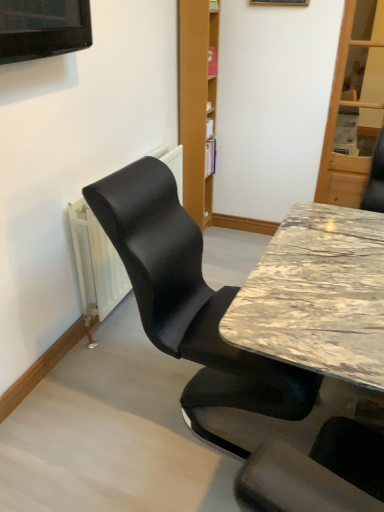
Question: From a real-world perspective, is marble table at center on black leather chair at left?

Choices:
 (A) yes
 (B) no

Answer: (B)

Question: Can you confirm if marble table at center is shorter than black leather chair at left?

Choices:
 (A) yes
 (B) no

Answer: (A)

Question: Would you say marble table at center is outside black leather chair at left?

Choices:
 (A) yes
 (B) no

Answer: (A)

Question: Is marble table at center at the right side of black leather chair at left?

Choices:
 (A) no
 (B) yes

Answer: (B)

Question: Can you confirm if marble table at center is thinner than black leather chair at left?

Choices:
 (A) yes
 (B) no

Answer: (A)

Question: Considering the relative sizes of marble table at center and black leather chair at left in the image provided, is marble table at center taller than black leather chair at left?

Choices:
 (A) yes
 (B) no

Answer: (B)

Question: Is black leather chair at left to the left of metallic gold picture frame at upper center from the viewer's perspective?

Choices:
 (A) no
 (B) yes

Answer: (B)

Question: Considering the relative sizes of black leather chair at left and metallic gold picture frame at upper center in the image provided, is black leather chair at left thinner than metallic gold picture frame at upper center?

Choices:
 (A) yes
 (B) no

Answer: (B)

Question: Is black leather chair at left wider than metallic gold picture frame at upper center?

Choices:
 (A) yes
 (B) no

Answer: (A)

Question: From a real-world perspective, is black leather chair at left positioned over metallic gold picture frame at upper center based on gravity?

Choices:
 (A) yes
 (B) no

Answer: (B)

Question: Is metallic gold picture frame at upper center located within black leather chair at left?

Choices:
 (A) yes
 (B) no

Answer: (B)

Question: Is black leather chair at left at the right side of metallic gold picture frame at upper center?

Choices:
 (A) no
 (B) yes

Answer: (A)

Question: Is black leather chair at left positioned with its back to marble table at center?

Choices:
 (A) yes
 (B) no

Answer: (B)